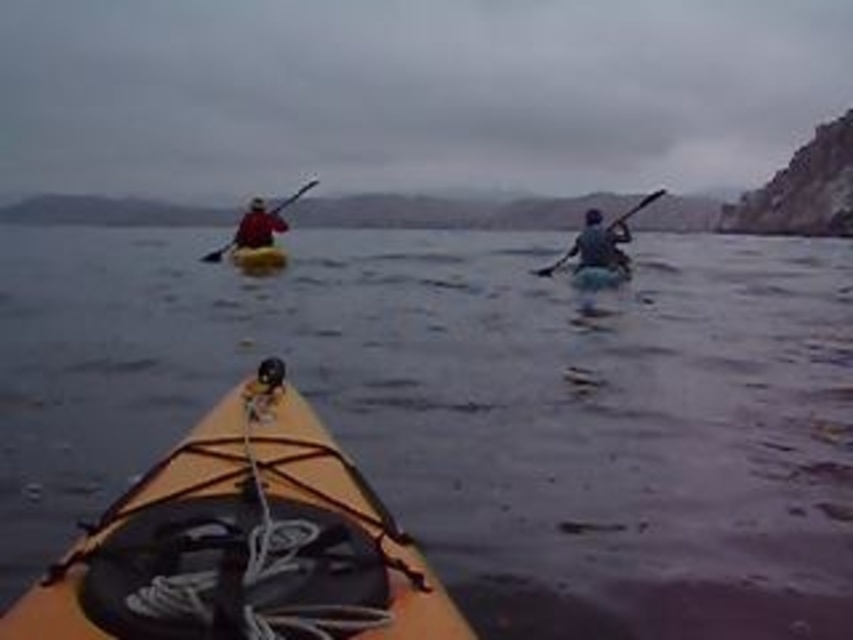
You are in a kayak and see two black paddles in the water. The smooth black paddle at right and the matte black paddle at upper left. Which one is positioned to the right side of the other?

The smooth black paddle at right is positioned to the right of the matte black paddle at upper left.

You are in a yellow kayak and want to reach the matte blue kayak at center. There is a matte black paddle at upper left in your path. Can you safely navigate around the paddle without hitting it?

The matte blue kayak at center is below the matte black paddle at upper left, meaning the paddle is positioned above the kayak in the scene. Since the paddle is above, you can safely navigate around it by moving below the paddle to reach the matte blue kayak at center.

You are in a yellow kayak and want to paddle towards the matte blue kayak at center. Which direction should you turn to avoid the matte black paddle at upper left?

The matte blue kayak at center is positioned on the right side of the matte black paddle at upper left, so you should turn to your right to avoid the matte black paddle at upper left and head towards the matte blue kayak at center.